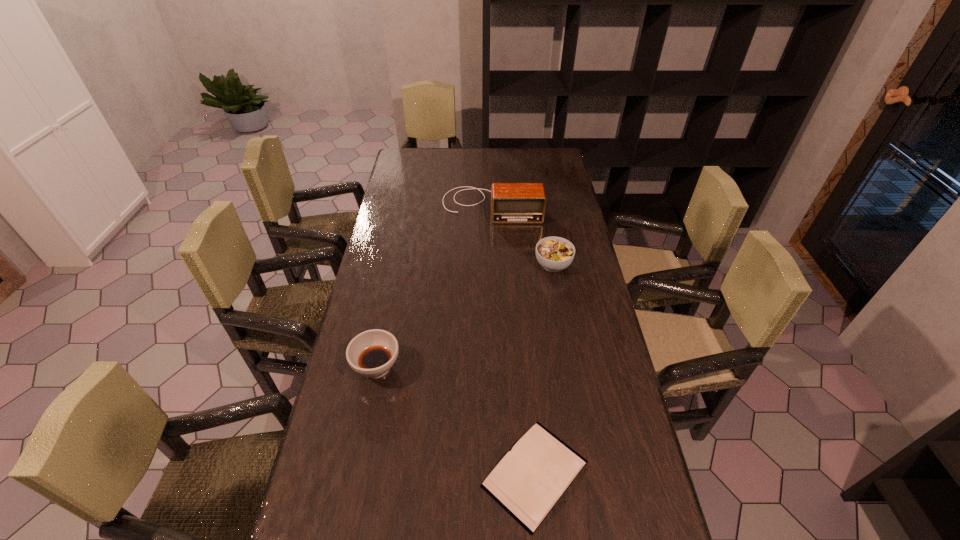
The height and width of the screenshot is (540, 960). Identify the location of free space between the left soup bowl and the farther soup bowl. (465, 316).

Identify the location of free space between the tallest object and the third nearest object. The width and height of the screenshot is (960, 540). (522, 235).

Find the location of `free space between the radio receiver and the shortest object`. free space between the radio receiver and the shortest object is located at coordinates (513, 340).

What are the coordinates of `unoccupied position between the farthest object and the farther soup bowl` in the screenshot? It's located at (522, 235).

I want to click on vacant area that lies between the right soup bowl and the leftmost object, so click(x=465, y=316).

Locate an element on the screen. The width and height of the screenshot is (960, 540). vacant area between the tallest object and the third farthest object is located at coordinates [x=434, y=286].

Image resolution: width=960 pixels, height=540 pixels. I want to click on free space that is in between the shortest object and the farther soup bowl, so click(544, 369).

Where is `free space between the nearer soup bowl and the second farthest object`? The width and height of the screenshot is (960, 540). free space between the nearer soup bowl and the second farthest object is located at coordinates (465, 316).

The height and width of the screenshot is (540, 960). I want to click on unoccupied position between the nearer soup bowl and the shortest object, so click(456, 420).

Locate an element on the screen. This screenshot has height=540, width=960. empty space between the farther soup bowl and the tallest object is located at coordinates (522, 235).